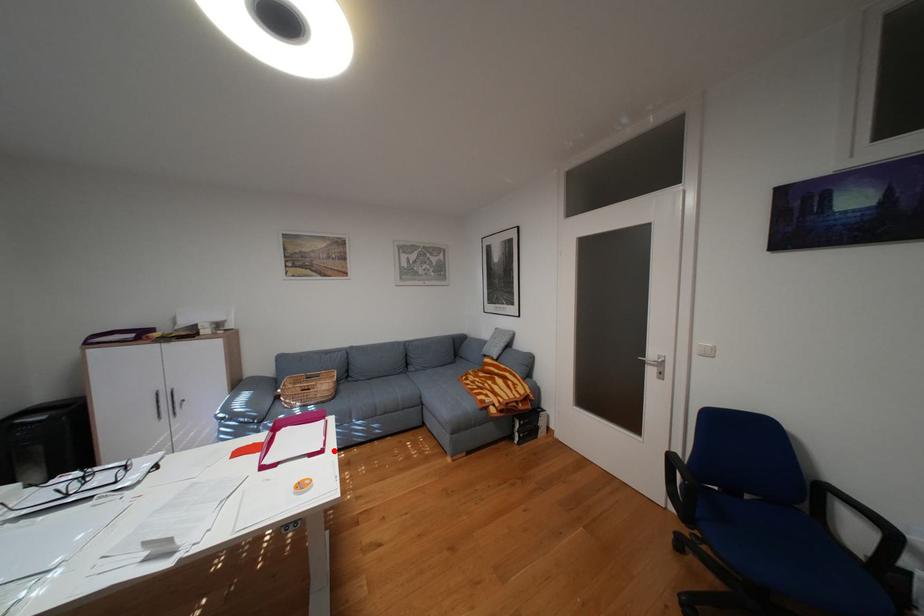
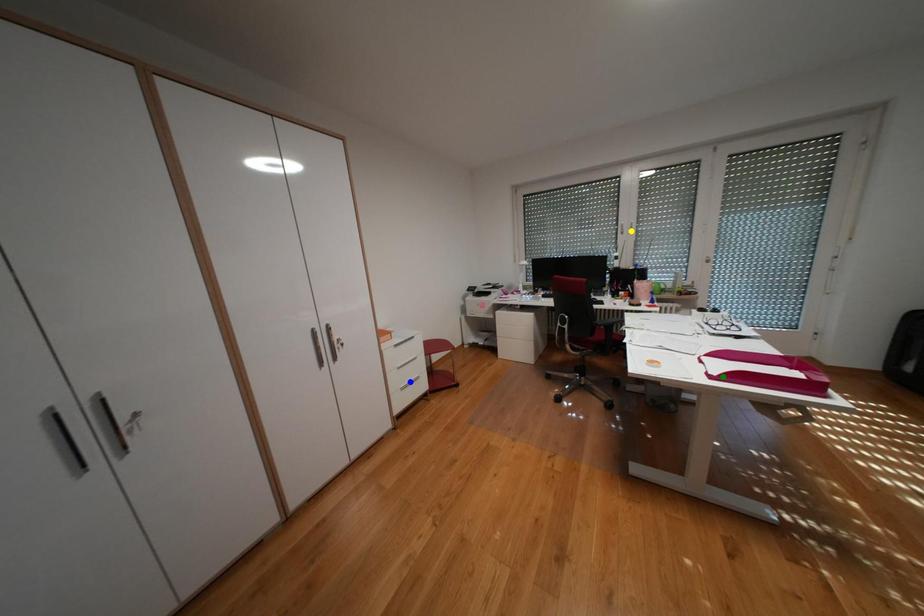
Question: I am providing you with two images of the same scene from different viewpoints. A red point is marked on the first image. You are given multiple points on the second image. In image 2, which mark is for the same physical point as the one in image 1?

Choices:
 (A) yellow point
 (B) blue point
 (C) green point

Answer: (C)